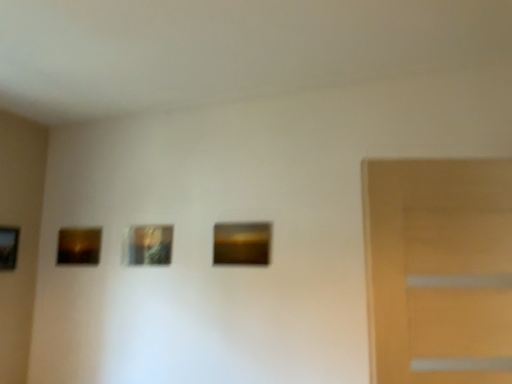
Question: Is matte brown picture frame at center, the first picture frame in the right-to-left sequence, to the right of metallic gold picture frame at center, which is the 2th picture frame in right-to-left order, from the viewer's perspective?

Choices:
 (A) no
 (B) yes

Answer: (B)

Question: Would you say matte brown picture frame at center, which is counted as the 4th picture frame, starting from the left, is outside metallic gold picture frame at center, which is the 2th picture frame in right-to-left order?

Choices:
 (A) yes
 (B) no

Answer: (A)

Question: Are matte brown picture frame at center, the first picture frame in the right-to-left sequence, and metallic gold picture frame at center, arranged as the third picture frame when viewed from the left, located far from each other?

Choices:
 (A) no
 (B) yes

Answer: (A)

Question: Is matte brown picture frame at center, which is counted as the 4th picture frame, starting from the left, behind metallic gold picture frame at center, arranged as the third picture frame when viewed from the left?

Choices:
 (A) no
 (B) yes

Answer: (A)

Question: Is matte brown picture frame at center, which is counted as the 4th picture frame, starting from the left, positioned in front of metallic gold picture frame at center, arranged as the third picture frame when viewed from the left?

Choices:
 (A) no
 (B) yes

Answer: (B)

Question: From the image's perspective, relative to metallic gold picture frame at center, arranged as the third picture frame when viewed from the left, is matte brown picture frame at center, which is counted as the 4th picture frame, starting from the left, above or below?

Choices:
 (A) above
 (B) below

Answer: (A)

Question: Visually, is matte brown picture frame at center, which is counted as the 4th picture frame, starting from the left, positioned to the left or to the right of metallic gold picture frame at center, arranged as the third picture frame when viewed from the left?

Choices:
 (A) left
 (B) right

Answer: (B)

Question: From a real-world perspective, is matte brown picture frame at center, the first picture frame in the right-to-left sequence, above or below metallic gold picture frame at center, arranged as the third picture frame when viewed from the left?

Choices:
 (A) below
 (B) above

Answer: (A)

Question: Is matte brown picture frame at center, the first picture frame in the right-to-left sequence, situated inside metallic gold picture frame at center, which is the 2th picture frame in right-to-left order, or outside?

Choices:
 (A) inside
 (B) outside

Answer: (B)

Question: In terms of width, does wooden picture frame at left, which is counted as the first picture frame, starting from the left, look wider or thinner when compared to matte brown picture frame at center, which is counted as the 4th picture frame, starting from the left?

Choices:
 (A) wide
 (B) thin

Answer: (A)

Question: From a real-world perspective, relative to matte brown picture frame at center, which is counted as the 4th picture frame, starting from the left, is wooden picture frame at left, which is counted as the first picture frame, starting from the left, vertically above or below?

Choices:
 (A) above
 (B) below

Answer: (B)

Question: Is wooden picture frame at left, which is counted as the first picture frame, starting from the left, in front of or behind matte brown picture frame at center, the first picture frame in the right-to-left sequence, in the image?

Choices:
 (A) behind
 (B) front

Answer: (A)

Question: Considering the positions of wooden picture frame at left, which is the fourth picture frame in right-to-left order, and matte brown picture frame at center, which is counted as the 4th picture frame, starting from the left, in the image, is wooden picture frame at left, which is the fourth picture frame in right-to-left order, bigger or smaller than matte brown picture frame at center, which is counted as the 4th picture frame, starting from the left,?

Choices:
 (A) small
 (B) big

Answer: (B)

Question: From a real-world perspective, relative to wooden picture frame at left, which is counted as the first picture frame, starting from the left, is matte brown picture frame at left, the 3th picture frame positioned from the right, vertically above or below?

Choices:
 (A) above
 (B) below

Answer: (A)

Question: Considering the positions of point (71, 233) and point (14, 241), is point (71, 233) closer or farther from the camera than point (14, 241)?

Choices:
 (A) farther
 (B) closer

Answer: (A)